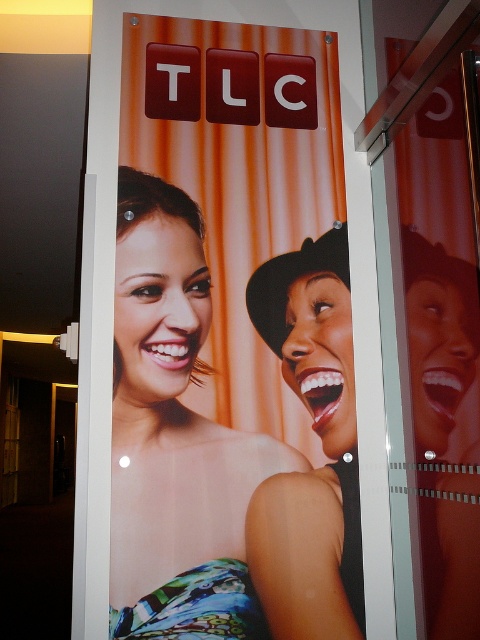
You are standing in front of the TLC promotional poster and want to touch both the matte skin tone woman at center and the smooth black hat at right. Which object will you need to reach out further to touch?

The smooth black hat at right is further away from the viewer than the matte skin tone woman at center, so you will need to reach out further to touch the smooth black hat at right.